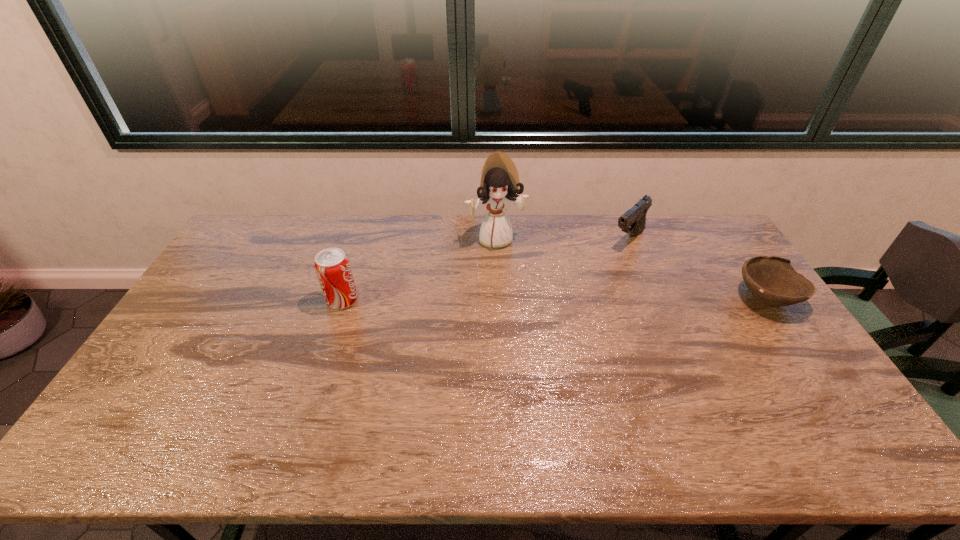
Where is `vacant space that satisfies the following two spatial constraints: 1. on the back side of the leftmost object; 2. on the right side of the tallest object`? Image resolution: width=960 pixels, height=540 pixels. vacant space that satisfies the following two spatial constraints: 1. on the back side of the leftmost object; 2. on the right side of the tallest object is located at coordinates (362, 239).